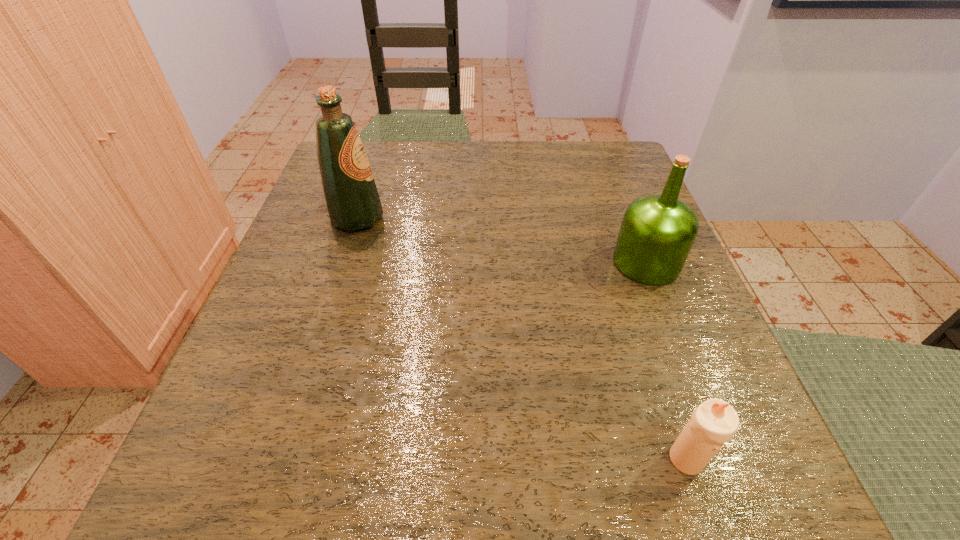
This screenshot has width=960, height=540. I want to click on empty space that is in between the right olive oil and the candle, so click(x=666, y=361).

This screenshot has width=960, height=540. What are the coordinates of `vacant point located between the shortest object and the left olive oil` in the screenshot? It's located at (522, 339).

The height and width of the screenshot is (540, 960). I want to click on vacant area that lies between the right olive oil and the nearest object, so coord(666,361).

Locate an element on the screen. vacant space that is in between the leftmost object and the second farthest object is located at coordinates (502, 240).

Identify the location of free space between the nearer olive oil and the candle. This screenshot has width=960, height=540. (666, 361).

Find the location of a particular element. The width and height of the screenshot is (960, 540). free space between the taller olive oil and the shortest object is located at coordinates (522, 339).

The width and height of the screenshot is (960, 540). I want to click on free space between the right olive oil and the shortest object, so click(x=666, y=361).

Locate an element on the screen. unoccupied area between the leftmost object and the candle is located at coordinates (522, 339).

Locate an element on the screen. free point between the shortest object and the farthest object is located at coordinates (522, 339).

Find the location of `object that ranks as the second closest to the right olive oil`. object that ranks as the second closest to the right olive oil is located at coordinates (352, 200).